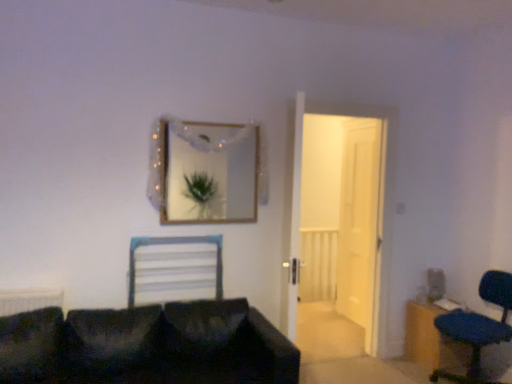
What are the coordinates of `blank area to the left of white wooden door at center, the 2th door from the front` in the screenshot? It's located at (317, 321).